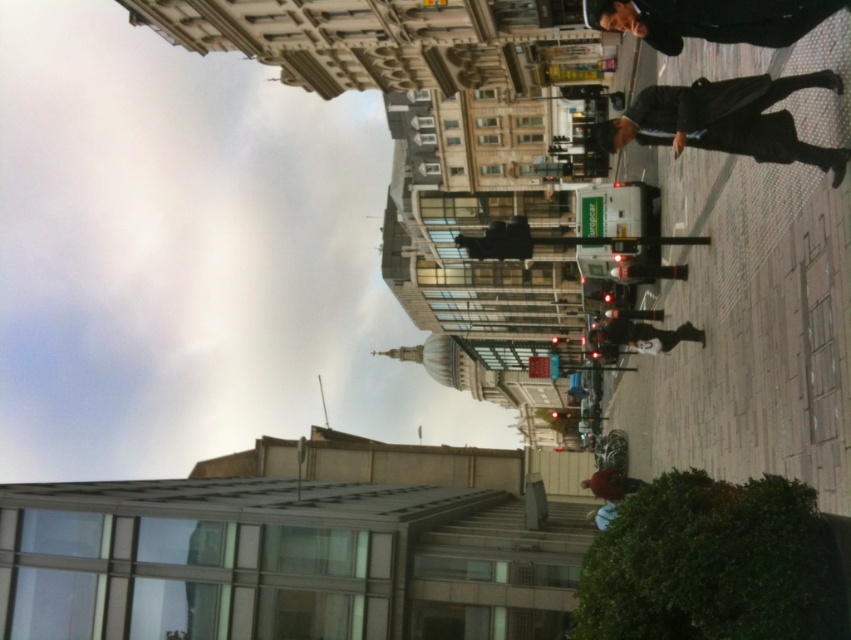
You are a photographer standing on the street in the scene. You want to take a photo of the dark blue suit at right and dark gray jacket at center. Which one should you adjust your camera angle to capture first if you are moving from left to right along the street?

You should adjust your camera angle to capture the dark gray jacket at center first because the dark blue suit at right is to the right of dark gray jacket at center, so moving from left to right, the dark gray jacket at center comes before the dark blue suit at right.

You are standing at the camera position and want to estimate how far the dark blue suit at right is from you. Based on the scene, can you provide an approximate distance?

The dark blue suit at right is approximately 35.23 meters away from the camera position.

You are a photographer standing on the street. You want to take a photo of the dark blue suit at right and dark gray jacket at center. Which one is higher in the frame?

The dark blue suit at right is above the dark gray jacket at center in the frame.